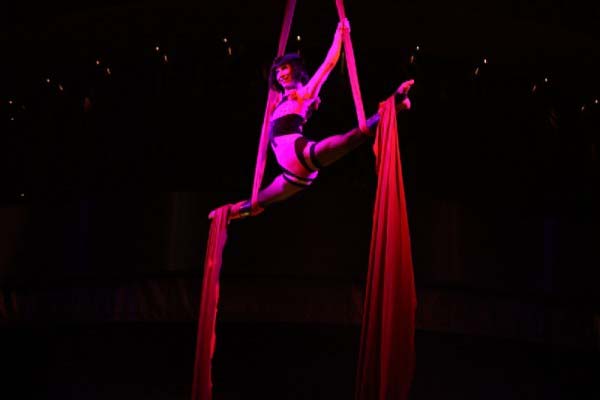
The width and height of the screenshot is (600, 400). In order to click on small white light in this screenshot , I will do `click(43, 78)`, `click(100, 55)`, `click(156, 45)`, `click(222, 38)`, `click(299, 37)`, `click(417, 47)`, `click(483, 62)`, `click(546, 78)`, `click(595, 102)`.